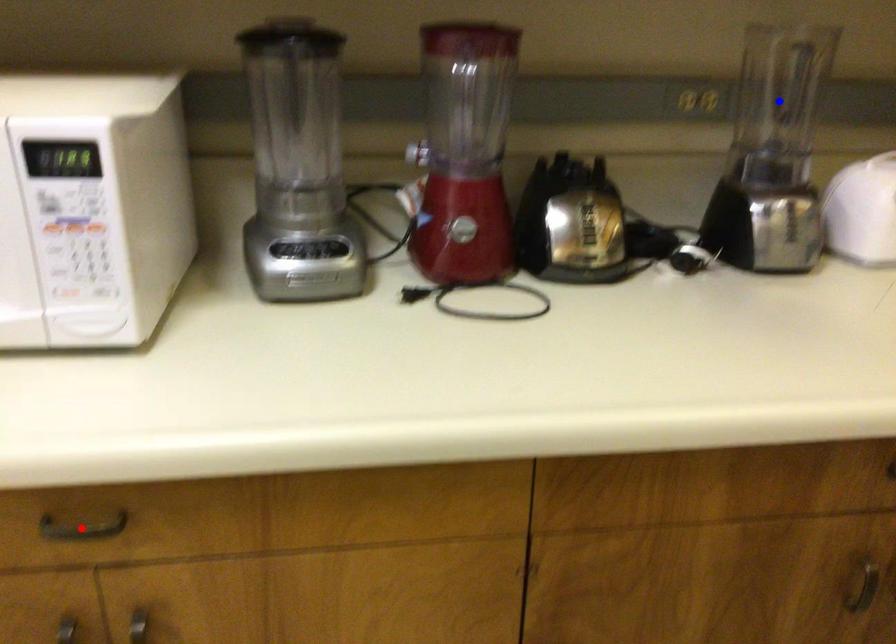
Question: Two points are marked on the image. Which point is closer to the camera?

Choices:
 (A) Blue point is closer.
 (B) Red point is closer.

Answer: (B)